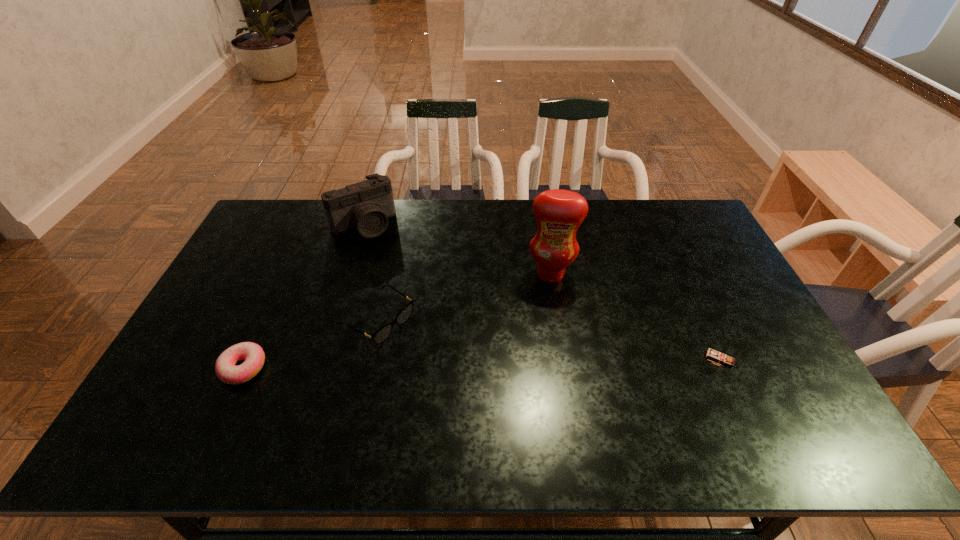
At what (x,y) coordinates should I click in order to perform the action: click on free space on the desktop that is between the shortest object and the rightmost object and is positioned on the front-facing side of the fourth tallest object. Please return your answer as a coordinate pair (x, y). The height and width of the screenshot is (540, 960). Looking at the image, I should click on (450, 364).

Locate an element on the screen. This screenshot has height=540, width=960. free spot on the desktop that is between the leftmost object and the matchbox and is positioned on the label side of the fourth object from left to right is located at coordinates (542, 362).

Locate an element on the screen. free space on the desktop that is between the doughnut and the rightmost object and is positioned at the lens of the farthest object is located at coordinates (459, 364).